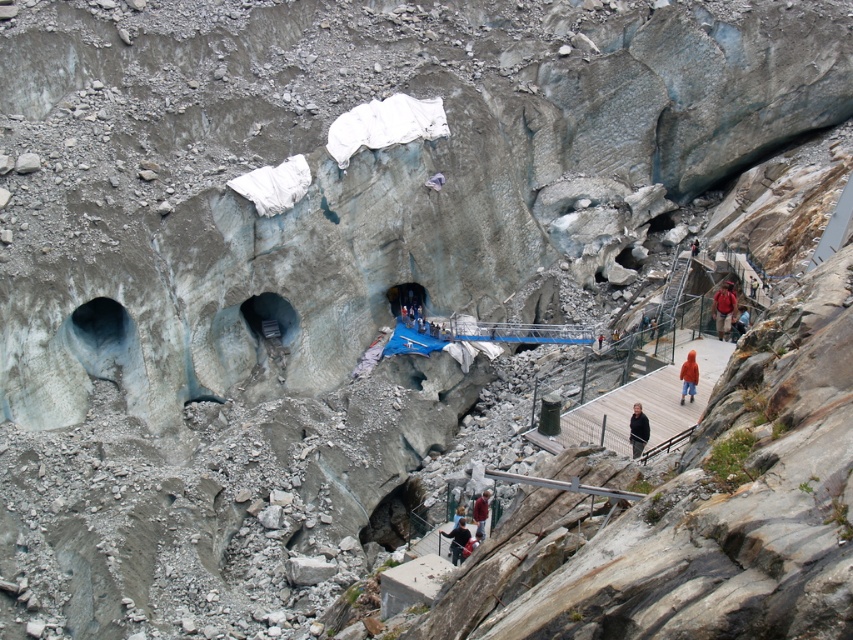
Is point (641, 429) behind point (479, 500)?

No, (641, 429) is closer to viewer.

Who is more distant from viewer, (634, 444) or (477, 500)?

Point (477, 500)

Image resolution: width=853 pixels, height=640 pixels. In order to click on black matte jacket at lower right in this screenshot , I will do `click(637, 429)`.

Who is higher up, orange fuzzy jacket at lower right or dark blue jacket at lower center?

orange fuzzy jacket at lower right

Does point (691, 369) lie behind point (447, 532)?

Yes, it is behind point (447, 532).

Where is `orange fuzzy jacket at lower right`? orange fuzzy jacket at lower right is located at coordinates (688, 376).

At what (x,y) coordinates should I click in order to perform the action: click on orange fuzzy jacket at lower right. Please return your answer as a coordinate pair (x, y). The width and height of the screenshot is (853, 640). Looking at the image, I should click on (688, 376).

Is black matte jacket at lower right below dark blue jacket at lower center?

No, black matte jacket at lower right is not below dark blue jacket at lower center.

Locate an element on the screen. This screenshot has width=853, height=640. black matte jacket at lower right is located at coordinates (637, 429).

Where is `black matte jacket at lower right`? Image resolution: width=853 pixels, height=640 pixels. black matte jacket at lower right is located at coordinates (637, 429).